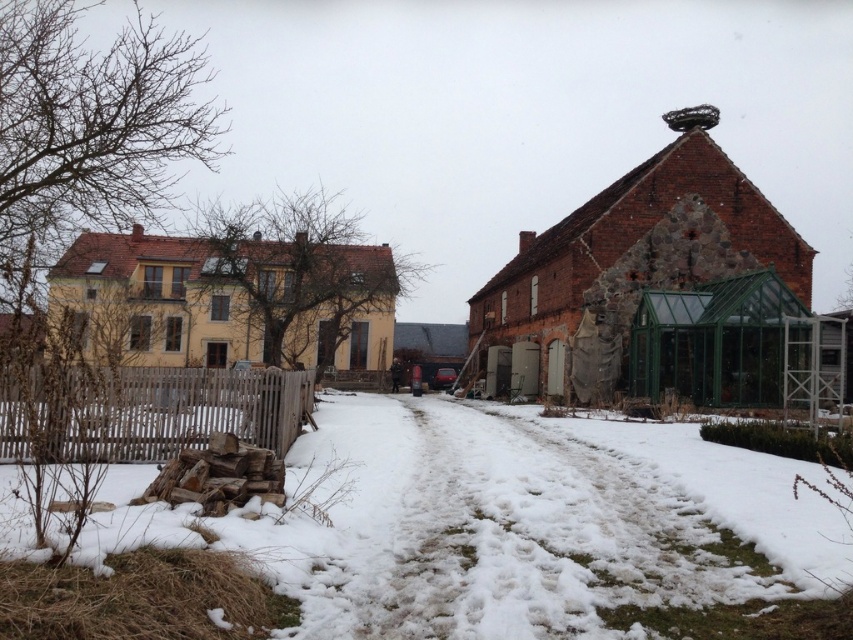
You are a delivery person approaching the yellow building with a red roof. You notice the white fluffy snow at lower left and the wooden picket fence at lower left. Which one is wider from your perspective?

The white fluffy snow at lower left is wider than the wooden picket fence at lower left from your perspective.

You are a delivery person trying to reach the yellow building with a red tiled roof. You see the white fluffy snow at lower left and the wooden picket fence at lower left. Which object is closer to the path leading to the yellow building?

The wooden picket fence at lower left is closer to the path leading to the yellow building because the white fluffy snow at lower left is positioned on the right side of the wooden picket fence at lower left, meaning the fence is between the snow and the path.